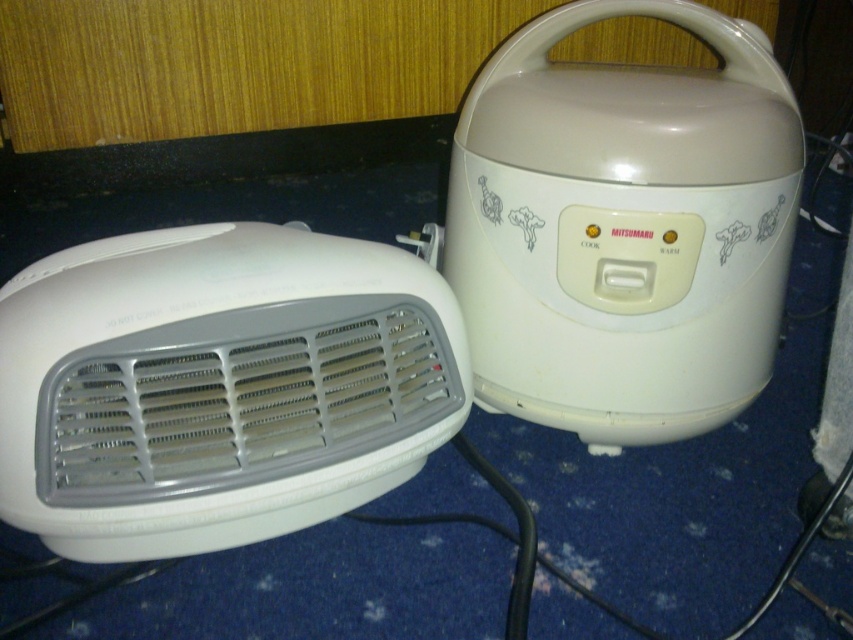
Is white plastic heater at left to the right of white glossy rice cooker at right from the viewer's perspective?

No, white plastic heater at left is not to the right of white glossy rice cooker at right.

Does white plastic heater at left have a lesser width compared to white glossy rice cooker at right?

No, white plastic heater at left is not thinner than white glossy rice cooker at right.

At what (x,y) coordinates should I click in order to perform the action: click on white plastic heater at left. Please return your answer as a coordinate pair (x, y). This screenshot has width=853, height=640. Looking at the image, I should click on (218, 387).